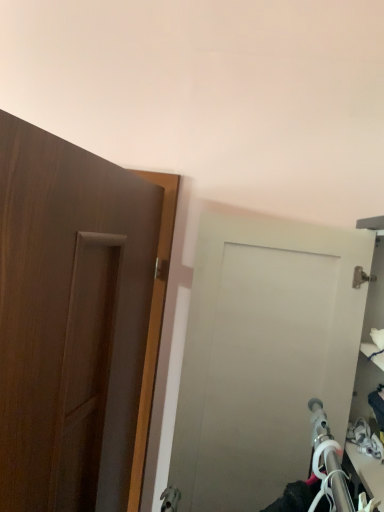
Question: Does point (76, 437) appear closer or farther from the camera than point (273, 227)?

Choices:
 (A) farther
 (B) closer

Answer: (B)

Question: From the image's perspective, is wooden door at left, which ranks as the second door in right-to-left order, located above or below matte white door at center, the first door in the right-to-left sequence?

Choices:
 (A) below
 (B) above

Answer: (B)

Question: In terms of height, does wooden door at left, which is the first door from left to right, look taller or shorter compared to matte white door at center, the first door in the right-to-left sequence?

Choices:
 (A) tall
 (B) short

Answer: (A)

Question: Considering their positions, is matte white door at center, the first door in the right-to-left sequence, located in front of or behind wooden door at left, which ranks as the second door in right-to-left order?

Choices:
 (A) front
 (B) behind

Answer: (B)

Question: From a real-world perspective, relative to wooden door at left, which ranks as the second door in right-to-left order, is matte white door at center, which is counted as the 2th door, starting from the left, vertically above or below?

Choices:
 (A) above
 (B) below

Answer: (A)

Question: Considering the positions of matte white door at center, which is counted as the 2th door, starting from the left, and wooden door at left, which ranks as the second door in right-to-left order, in the image, is matte white door at center, which is counted as the 2th door, starting from the left, taller or shorter than wooden door at left, which ranks as the second door in right-to-left order,?

Choices:
 (A) tall
 (B) short

Answer: (B)

Question: From the image's perspective, is matte white door at center, the first door in the right-to-left sequence, above or below wooden door at left, which is the first door from left to right?

Choices:
 (A) below
 (B) above

Answer: (A)